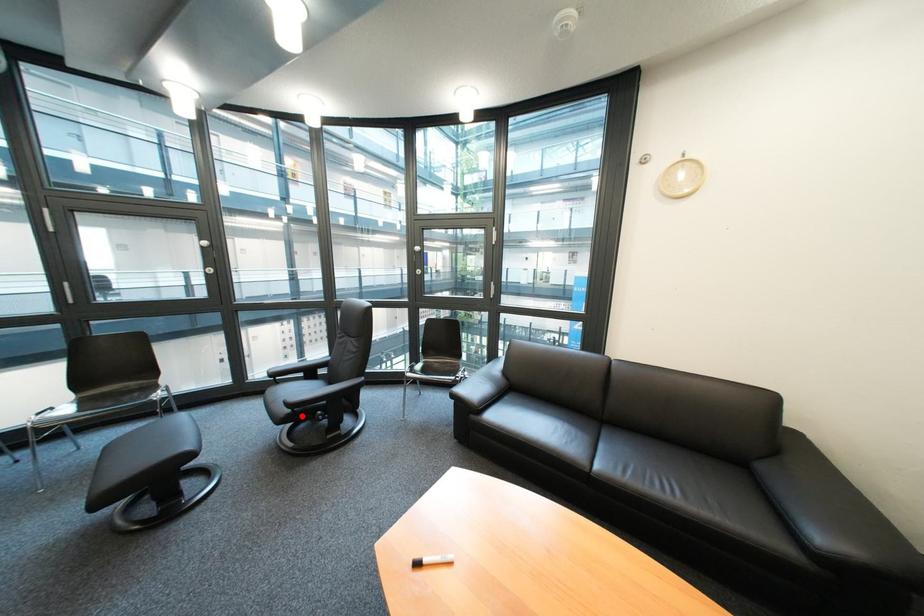
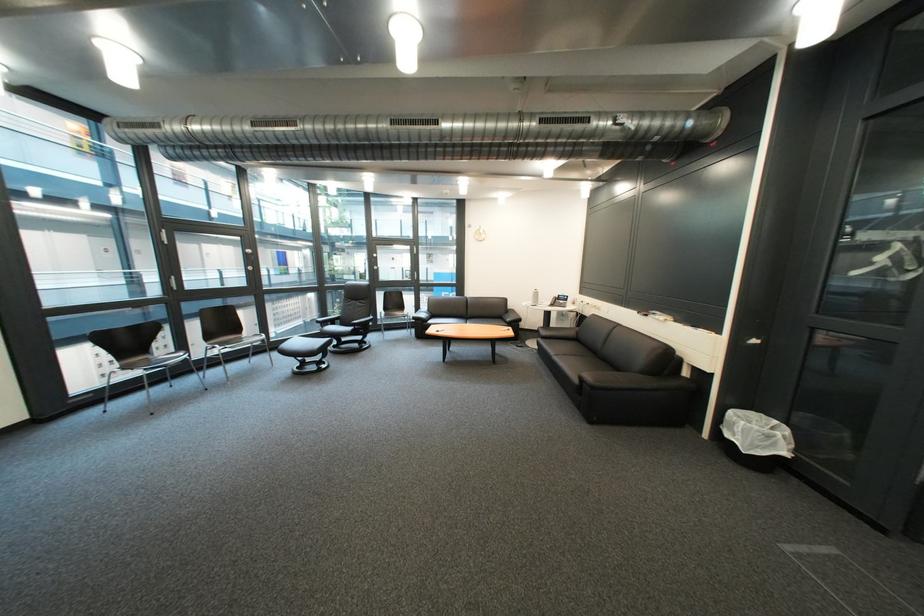
Question: I am providing you with two images of the same scene from different viewpoints. Image1 has a red point marked. In image2, the corresponding 3D location appears at what relative position? Reply with the corresponding letter.

Choices:
 (A) Closer
 (B) Farther

Answer: (A)